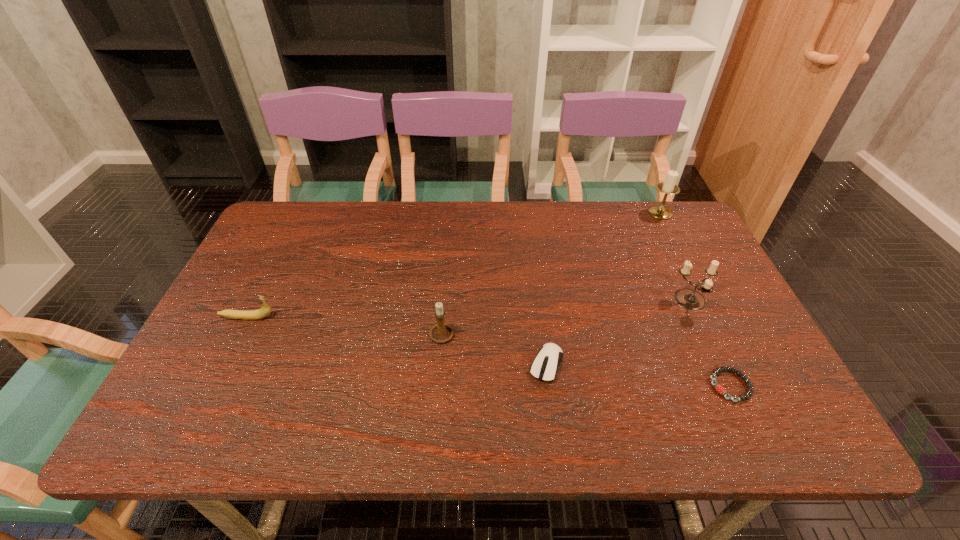
I want to click on free spot located on the front of the tallest object, so click(694, 280).

You are a GUI agent. You are given a task and a screenshot of the screen. Output one action in this format:
    pyautogui.click(x=<x>, y=<y>)
    Task: Click on the free point located on the front of the second farthest candle holder
    This screenshot has height=540, width=960.
    Given the screenshot: What is the action you would take?
    754,435

You are a GUI agent. You are given a task and a screenshot of the screen. Output one action in this format:
    pyautogui.click(x=<x>, y=<y>)
    Task: Click on the free space located on the side of the leftmost candle holder with the handle
    This screenshot has width=960, height=540.
    Given the screenshot: What is the action you would take?
    pyautogui.click(x=485, y=335)

Where is `free region located 0.360m at the stem of the leftmost object`? Image resolution: width=960 pixels, height=540 pixels. free region located 0.360m at the stem of the leftmost object is located at coordinates (416, 318).

Where is `vacant space located 0.280m on the right of the fourth object from right to left`? This screenshot has width=960, height=540. vacant space located 0.280m on the right of the fourth object from right to left is located at coordinates (685, 364).

Where is `free space located on the back of the bracelet`? This screenshot has height=540, width=960. free space located on the back of the bracelet is located at coordinates (708, 338).

Identify the location of object that is at the far edge. This screenshot has height=540, width=960. (668, 187).

At what (x,y) coordinates should I click in order to perform the action: click on object that is positioned at the near edge. Please return your answer as a coordinate pair (x, y). This screenshot has height=540, width=960. Looking at the image, I should click on (719, 388).

This screenshot has width=960, height=540. What are the coordinates of `object located at the left edge` in the screenshot? It's located at (263, 312).

Identify the location of bracelet located in the right edge section of the desktop. (719, 388).